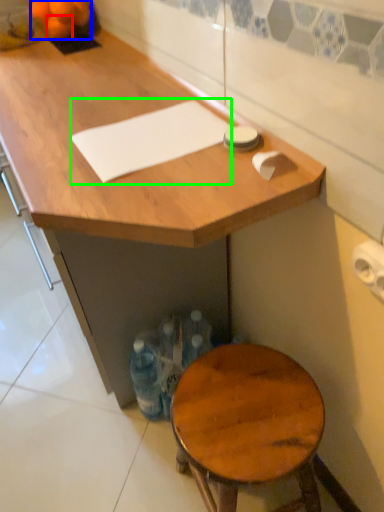
Question: Considering the real-world distances, which object is closest to tangerine (highlighted by a red box)? tangerine (highlighted by a blue box) or notepad (highlighted by a green box).

Choices:
 (A) tangerine
 (B) notepad

Answer: (A)